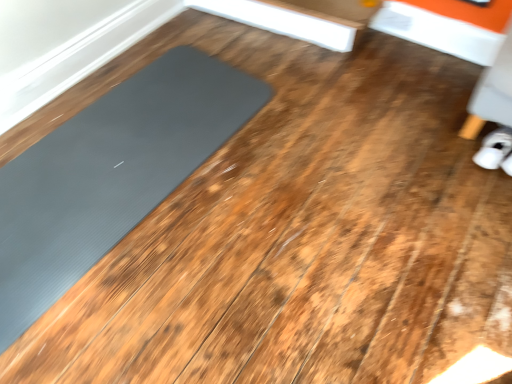
At what (x,y) coordinates should I click in order to perform the action: click on free area in between gray rubber mat at left and white fabric shoe at lower right. Please return your answer as a coordinate pair (x, y). Looking at the image, I should click on (287, 206).